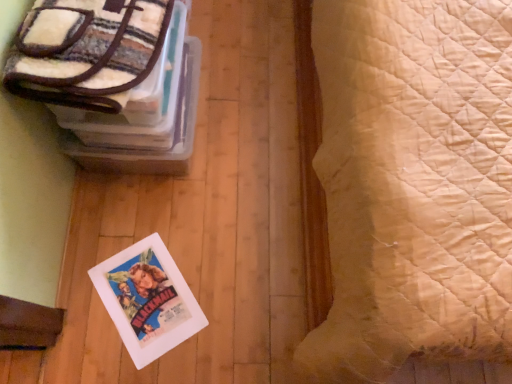
The image size is (512, 384). Describe the element at coordinates (86, 51) in the screenshot. I see `soft fleece blanket at upper left` at that location.

Image resolution: width=512 pixels, height=384 pixels. Find the location of `soft fleece blanket at upper left`. soft fleece blanket at upper left is located at coordinates (86, 51).

You are a GUI agent. You are given a task and a screenshot of the screen. Output one action in this format:
    pyautogui.click(x=<x>, y=<y>)
    Task: Click on the soft fleece blanket at upper left
    The height and width of the screenshot is (384, 512).
    Given the screenshot: What is the action you would take?
    pyautogui.click(x=86, y=51)